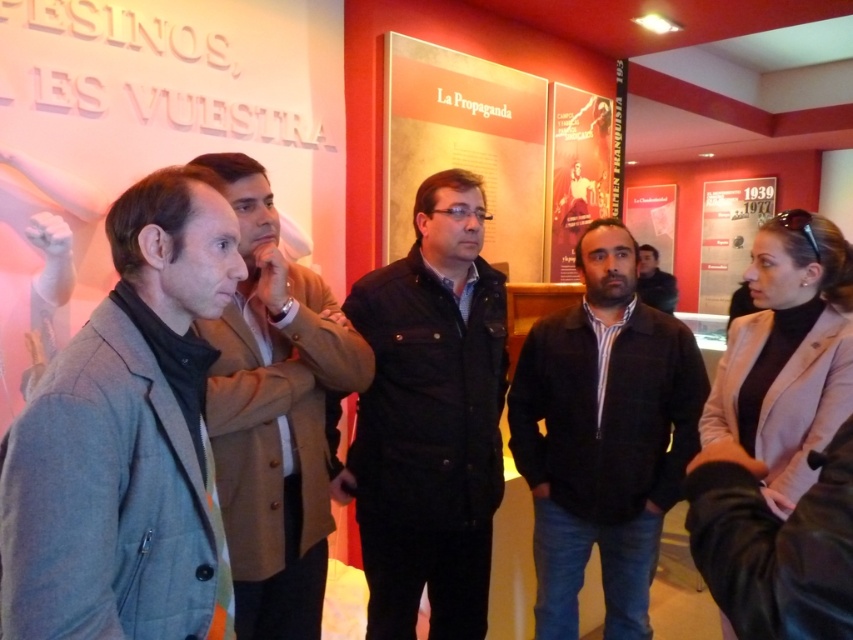
You are standing in the museum and want to take a photo of the gray woolen coat at left. Where should you position yourself to capture it in the frame?

To capture the gray woolen coat at left in your photo, position yourself so that the coat is located at the coordinates approximately 0.683 along the horizontal axis and 0.147 along the vertical axis within the frame.

Consider the image. You are an art student who wants to take a photo of the matte paper poster at upper center without the matte red poster at upper right appearing in the background. Is this possible?

The matte paper poster at upper center is in front of the matte red poster at upper right, so you can take a photo of the matte paper poster at upper center while positioning yourself or adjusting the angle so that the matte red poster at upper right is not in the background.

You are a museum visitor who wants to take a photo of the dark brown leather jacket at center without including the gray woolen coat at left. Based on their positions, is this possible?

Yes, since the gray woolen coat at left is to the left of the dark brown leather jacket at center, you can position yourself to the right of the jacket and frame the shot to exclude the coat.